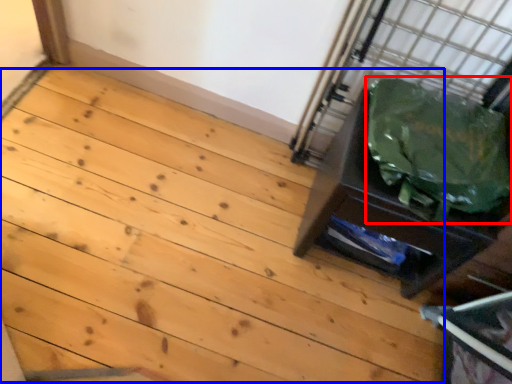
Question: Which of the following is the farthest to the observer, garbage (highlighted by a red box) or stairwell (highlighted by a blue box)?

Choices:
 (A) garbage
 (B) stairwell

Answer: (B)